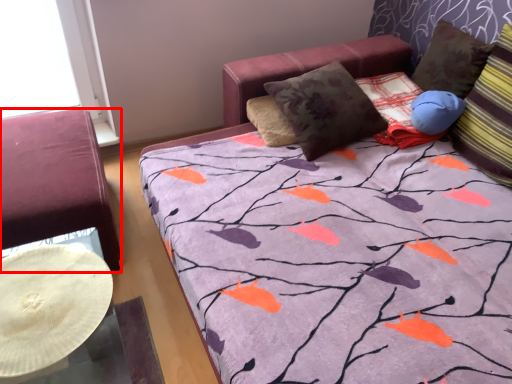
Question: Where is furniture (annotated by the red box) located in relation to pillow in the image?

Choices:
 (A) right
 (B) left

Answer: (B)